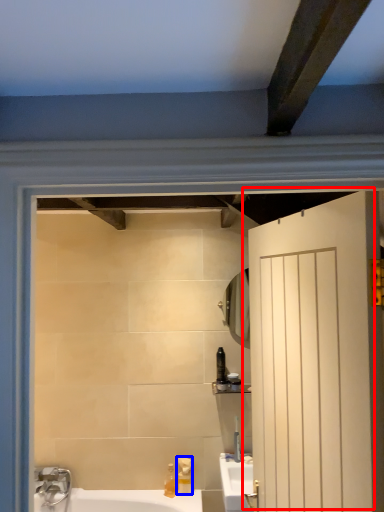
Question: Which point is closer to the camera, door (highlighted by a red box) or soap dispenser (highlighted by a blue box)?

Choices:
 (A) door
 (B) soap dispenser

Answer: (A)